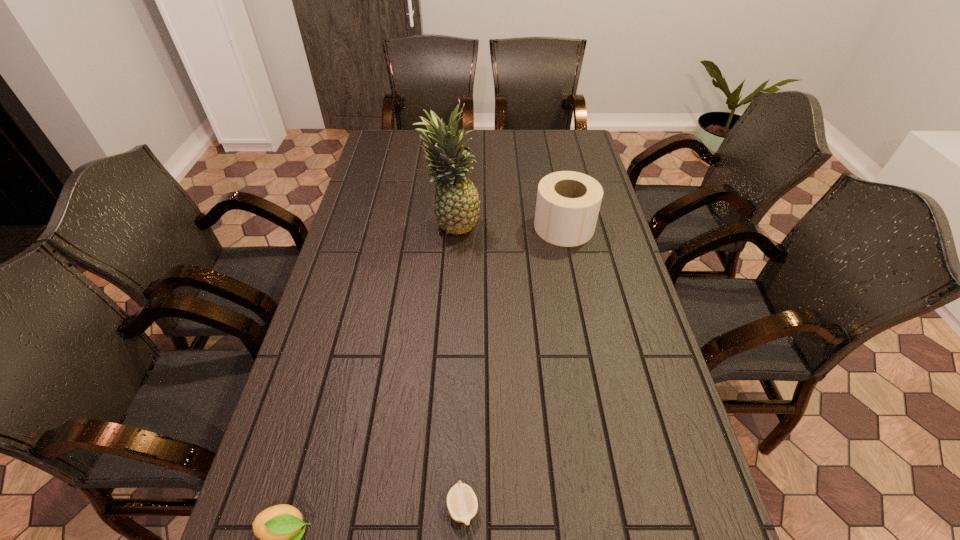
Identify the location of free space that satisfies the following two spatial constraints: 1. on the front side of the tallest object; 2. on the left side of the right lemon. This screenshot has height=540, width=960. (432, 508).